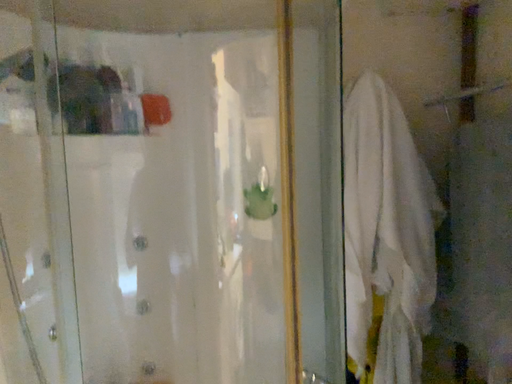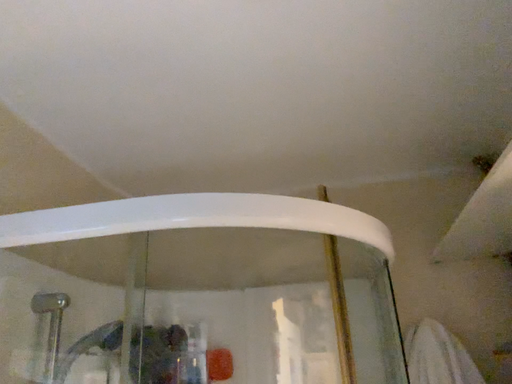
Question: How did the camera likely rotate when shooting the video?

Choices:
 (A) rotated right
 (B) rotated left

Answer: (B)